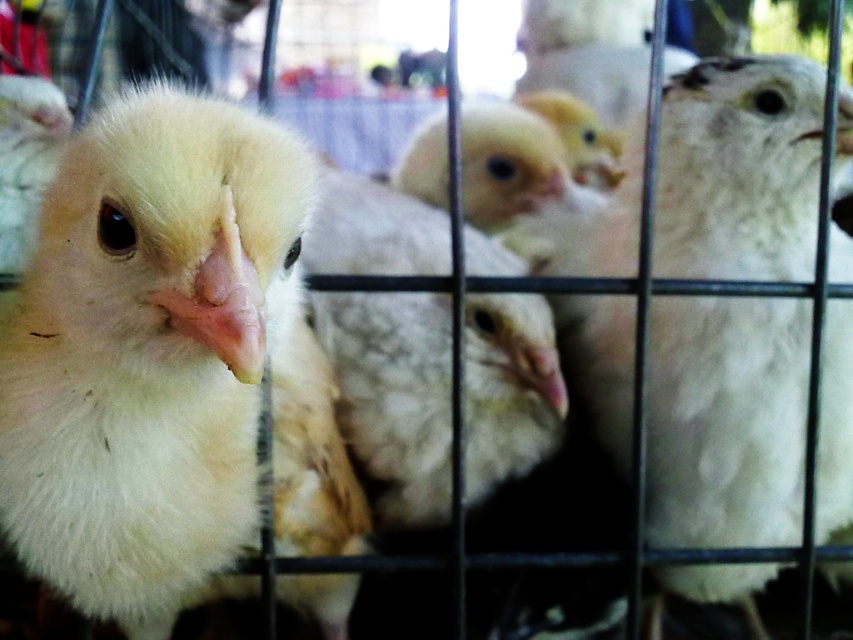
Question: In this image, where is fluffy white chick at center located relative to white fluffy chick at center?

Choices:
 (A) below
 (B) above

Answer: (A)

Question: Which point appears closest to the camera in this image?

Choices:
 (A) (426, 340)
 (B) (321, 497)

Answer: (B)

Question: Can you confirm if fluffy white chick at center is smaller than white fluffy chick at center?

Choices:
 (A) yes
 (B) no

Answer: (B)

Question: Which object appears closest to the camera in this image?

Choices:
 (A) white fluffy chick at center
 (B) fluffy white chick at center

Answer: (B)

Question: Is fluffy white chick at center closer to camera compared to white fluffy chick at center?

Choices:
 (A) no
 (B) yes

Answer: (B)